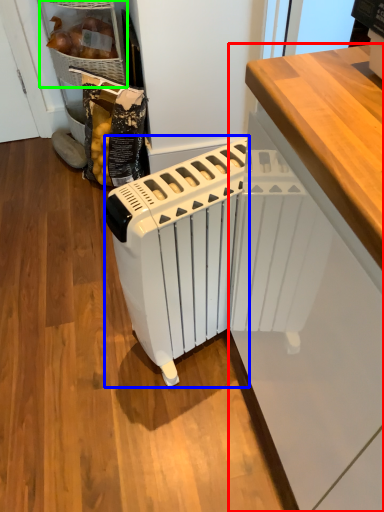
Question: Based on their relative distances, which object is farther from cabinetry (highlighted by a red box)? Choose from home appliance (highlighted by a blue box) and cabinetry (highlighted by a green box).

Choices:
 (A) home appliance
 (B) cabinetry

Answer: (B)